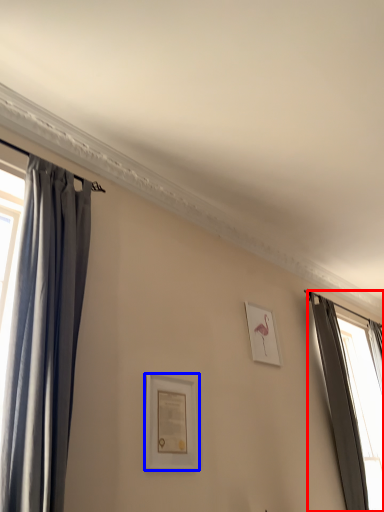
Question: Which object appears closest to the camera in this image, curtain (highlighted by a red box) or picture frame (highlighted by a blue box)?

Choices:
 (A) curtain
 (B) picture frame

Answer: (B)